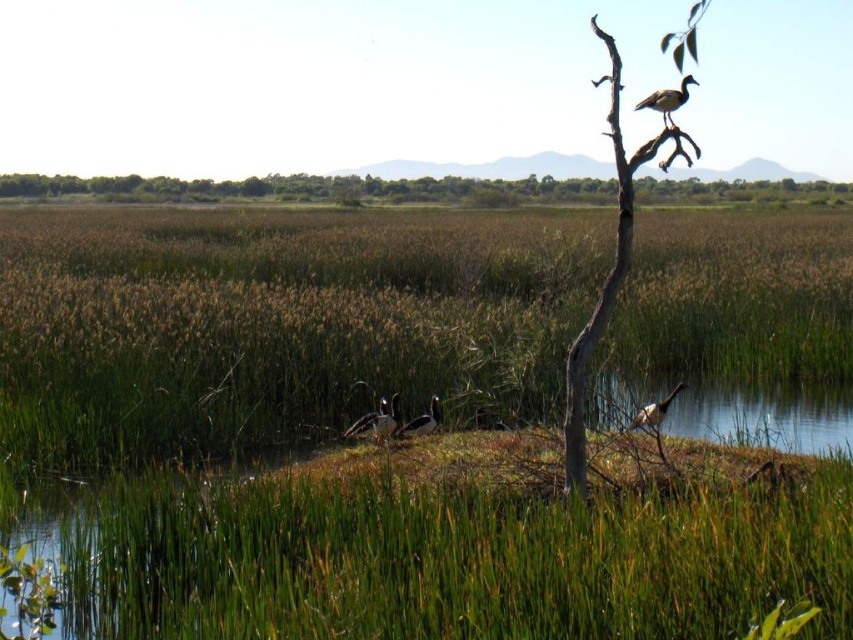
Can you confirm if brown speckled feathered bird at upper right is positioned below white glossy bird at upper right?

Actually, brown speckled feathered bird at upper right is above white glossy bird at upper right.

Who is positioned more to the left, brown speckled feathered bird at upper right or white glossy bird at upper right?

brown speckled feathered bird at upper right

Measure the distance between point (x=660, y=113) and camera.

Point (x=660, y=113) is 8.47 meters away from camera.

In order to click on brown speckled feathered bird at upper right in this screenshot , I will do `click(666, 99)`.

Is point (225, 346) behind point (413, 433)?

Yes, point (225, 346) is behind point (413, 433).

Can you confirm if green grass at center is wider than white glossy bird at center?

Yes.

Does point (227, 342) come in front of point (399, 435)?

No, it is behind (399, 435).

Identify the location of green grass at center. The image size is (853, 640). (279, 321).

Does brown wood tree at upper center appear on the right side of dark gray feathers at center?

Yes, brown wood tree at upper center is to the right of dark gray feathers at center.

Consider the image. Does brown wood tree at upper center have a lesser height compared to dark gray feathers at center?

In fact, brown wood tree at upper center may be taller than dark gray feathers at center.

The height and width of the screenshot is (640, 853). Find the location of `brown wood tree at upper center`. brown wood tree at upper center is located at coordinates (297, 188).